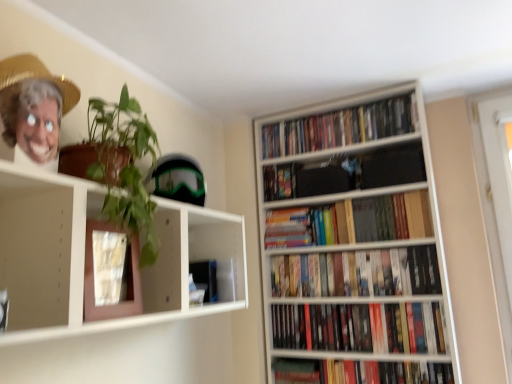
The width and height of the screenshot is (512, 384). Identify the location of free point above hardcover books at center, the 5th book viewed from the top (from a real-world perspective). (342, 251).